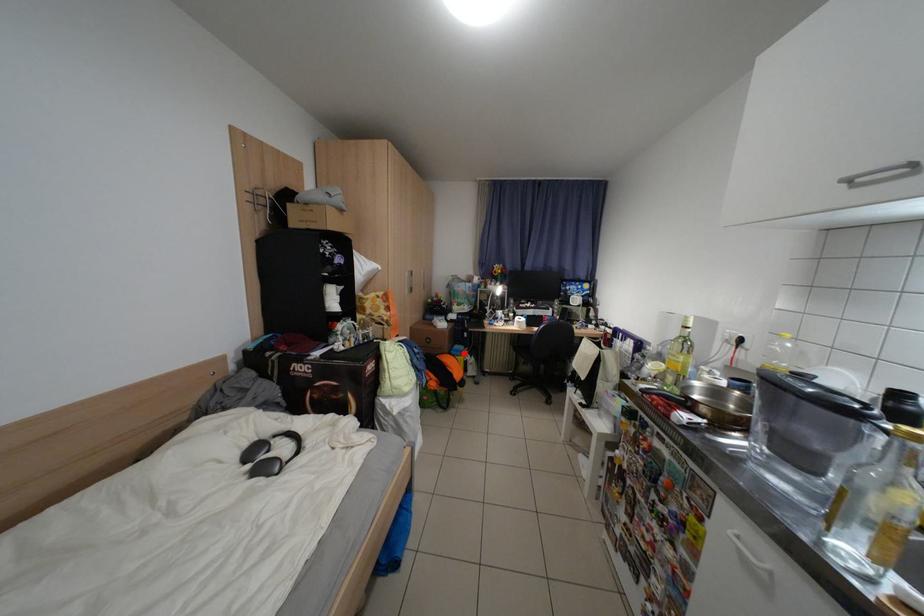
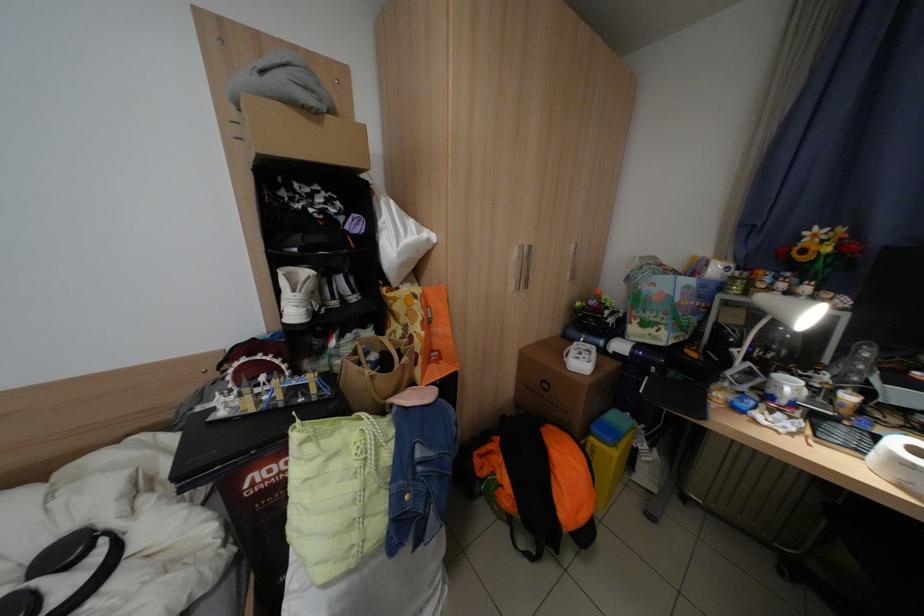
Question: A red point is marked in image1. In image2, is the corresponding 3D point closer to the camera or farther? Reply with the corresponding letter.

Choices:
 (A) The corresponding 3D point is closer.
 (B) The corresponding 3D point is farther.

Answer: (B)